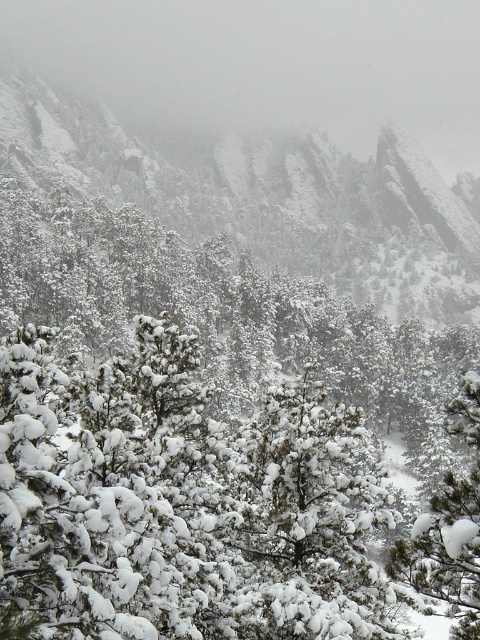
Question: Is snow-covered rock at center wider than white fluffy snow at center?

Choices:
 (A) yes
 (B) no

Answer: (A)

Question: Which object appears farthest from the camera in this image?

Choices:
 (A) snow-covered rock at center
 (B) white fluffy snow at center
 (C) snow-covered evergreen at center

Answer: (A)

Question: Can you confirm if snow-covered evergreen at center is bigger than white fluffy snow at center?

Choices:
 (A) yes
 (B) no

Answer: (A)

Question: Which of the following is the closest to the observer?

Choices:
 (A) snow-covered evergreen at center
 (B) snow-covered rock at center

Answer: (A)

Question: Can you confirm if snow-covered evergreen at center is positioned above white fluffy snow at center?

Choices:
 (A) no
 (B) yes

Answer: (B)

Question: Among these points, which one is nearest to the camera?

Choices:
 (A) (338, 480)
 (B) (68, 157)

Answer: (A)